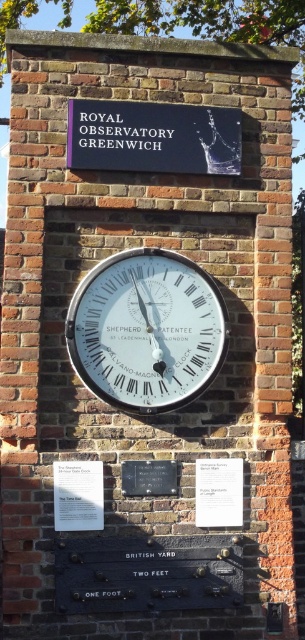
Which is behind, point (82, 118) or point (229, 480)?

The point (82, 118) is behind.

How far apart are blue plastic sign at upper center and white paper plaque at center?

4.11 feet

Where is `blue plastic sign at upper center`? The height and width of the screenshot is (640, 305). blue plastic sign at upper center is located at coordinates (153, 138).

Can you confirm if blue plastic sign at upper center is bigger than black stone plaque at center?

Yes.

Does blue plastic sign at upper center come behind black stone plaque at center?

Yes, it is behind black stone plaque at center.

Which is in front, point (162, 150) or point (161, 480)?

Point (161, 480) is in front.

I want to click on blue plastic sign at upper center, so click(153, 138).

Is white glossy clock at center thinner than blue plastic sign at upper center?

Yes, white glossy clock at center is thinner than blue plastic sign at upper center.

Which of these two, white glossy clock at center or blue plastic sign at upper center, stands taller?

With more height is white glossy clock at center.

Is point (107, 394) positioned after point (150, 150)?

No, it is not.

Locate an element on the screen. This screenshot has width=305, height=640. white glossy clock at center is located at coordinates (146, 330).